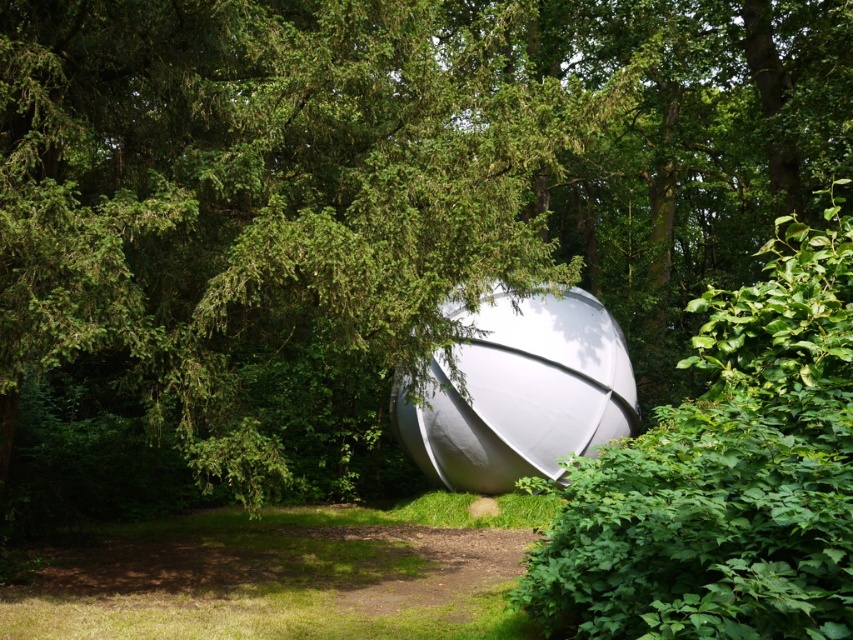
Question: Does green leafy bush at center come behind green grass at lower center?

Choices:
 (A) no
 (B) yes

Answer: (A)

Question: Is green leafy bush at center below white matte sphere at center?

Choices:
 (A) yes
 (B) no

Answer: (B)

Question: Which object is farther from the camera taking this photo?

Choices:
 (A) white matte sphere at center
 (B) green grass at lower center

Answer: (A)

Question: Which point is closer to the camera?

Choices:
 (A) green grass at lower center
 (B) white matte sphere at center

Answer: (A)

Question: Observing the image, what is the correct spatial positioning of green leafy bush at center in reference to white matte sphere at center?

Choices:
 (A) below
 (B) above

Answer: (B)

Question: Considering the real-world distances, which object is closest to the green grass at lower center?

Choices:
 (A) white matte sphere at center
 (B) green leafy bush at center

Answer: (A)